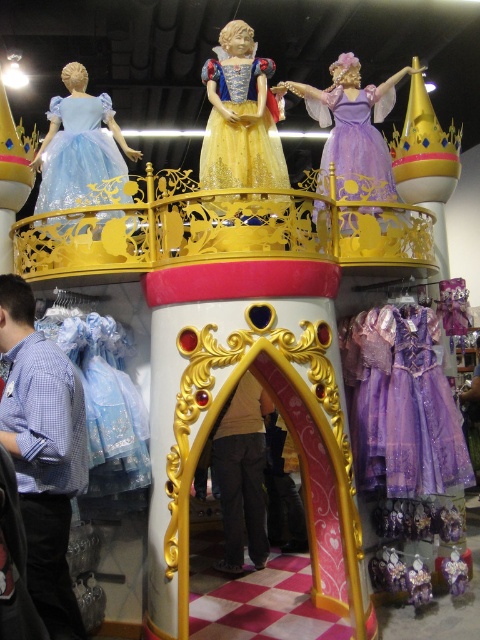
Question: Which object is farther from the camera taking this photo?

Choices:
 (A) dark gray pants at center
 (B) purple satin dress at center
 (C) light blue satin dress at left

Answer: (A)

Question: Among these points, which one is farthest from the camera?

Choices:
 (A) (369, 177)
 (B) (375, 145)

Answer: (B)

Question: Can you confirm if sparkly purple dress at lower right is positioned below light blue satin dress at left?

Choices:
 (A) no
 (B) yes

Answer: (B)

Question: Which of the following is the farthest from the observer?

Choices:
 (A) sparkly purple dress at lower right
 (B) golden sequined dress at center

Answer: (A)

Question: Is golden sequined dress at center to the left of lavender satin dress at center from the viewer's perspective?

Choices:
 (A) no
 (B) yes

Answer: (B)

Question: Considering the relative positions of golden sequined dress at center and lavender satin dress at center in the image provided, where is golden sequined dress at center located with respect to lavender satin dress at center?

Choices:
 (A) above
 (B) below

Answer: (B)